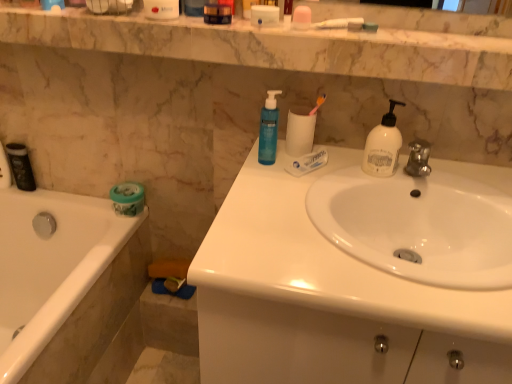
Locate an element on the screen. The width and height of the screenshot is (512, 384). free space in front of white matte toilet paper at center, which appears as the 1th toilet paper when viewed from the front is located at coordinates pyautogui.click(x=289, y=183).